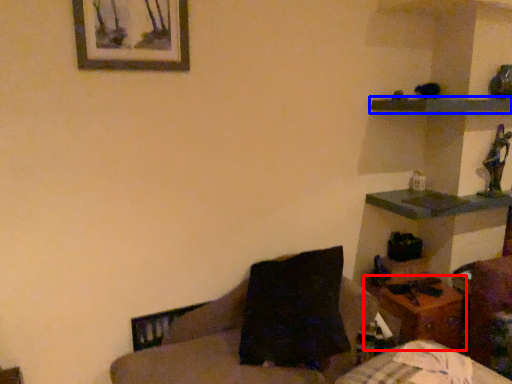
Question: Which point is closer to the camera, table (highlighted by a red box) or shelf (highlighted by a blue box)?

Choices:
 (A) table
 (B) shelf

Answer: (B)